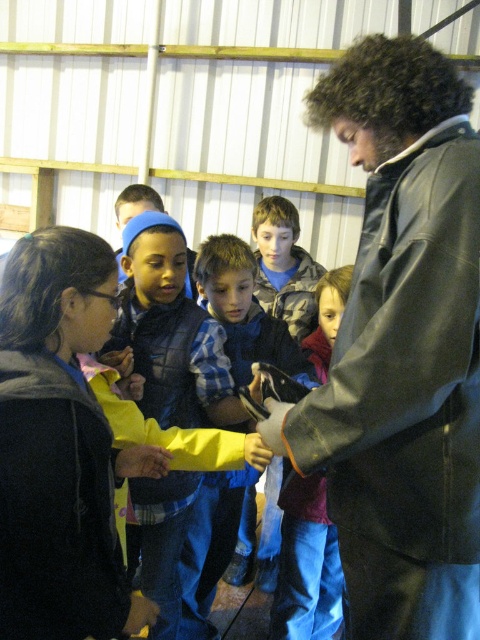
Who is positioned more to the right, black matte jacket at left or camouflage jacket at center?

camouflage jacket at center is more to the right.

Is black matte jacket at left shorter than camouflage jacket at center?

No.

Is point (60, 586) less distant than point (276, 205)?

That is True.

In order to click on black matte jacket at left in this screenshot , I will do `click(60, 445)`.

Between black leather jacket at center and maroon fleece jacket at center, which one appears on the right side from the viewer's perspective?

black leather jacket at center is more to the right.

Between point (372, 632) and point (312, 604), which one is positioned behind?

The point (312, 604) is more distant.

Who is more distant from viewer, (471, 248) or (309, 512)?

Point (309, 512)

Find the location of `black leather jacket at center`. black leather jacket at center is located at coordinates (402, 348).

Describe the element at coordinates (60, 445) in the screenshot. I see `black matte jacket at left` at that location.

Does black matte jacket at left have a greater width compared to blue plaid shirt at center?

In fact, black matte jacket at left might be narrower than blue plaid shirt at center.

Is point (44, 326) positioned in front of point (255, 358)?

Yes, it is in front of point (255, 358).

Identify the location of black matte jacket at left. This screenshot has width=480, height=640. [x=60, y=445].